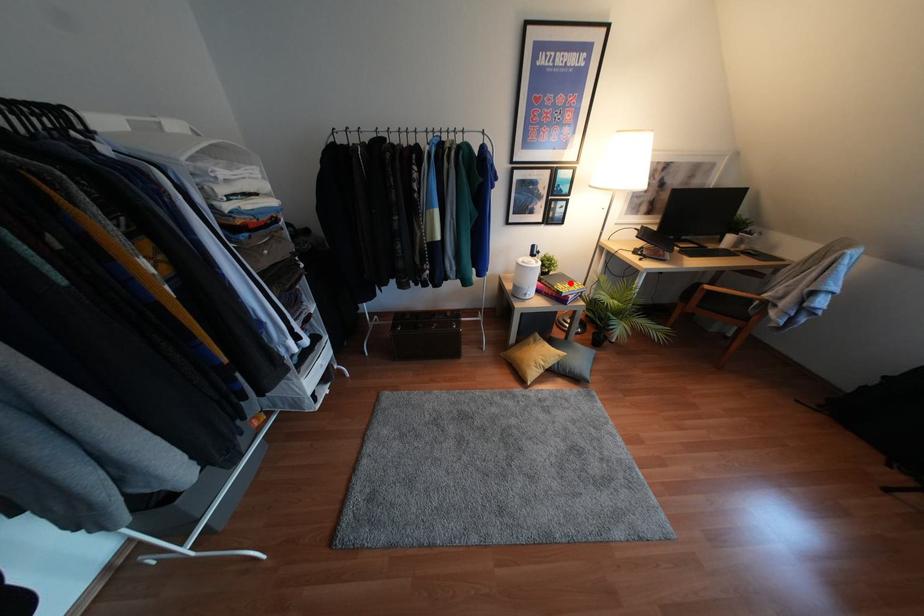
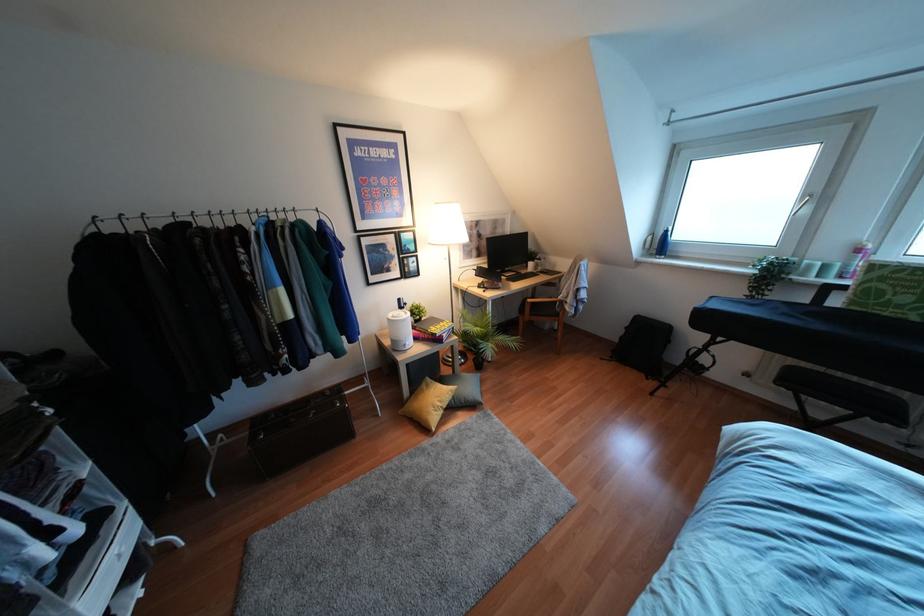
In the second image, find the point that corresponds to the highlighted location in the first image.

(441, 323)